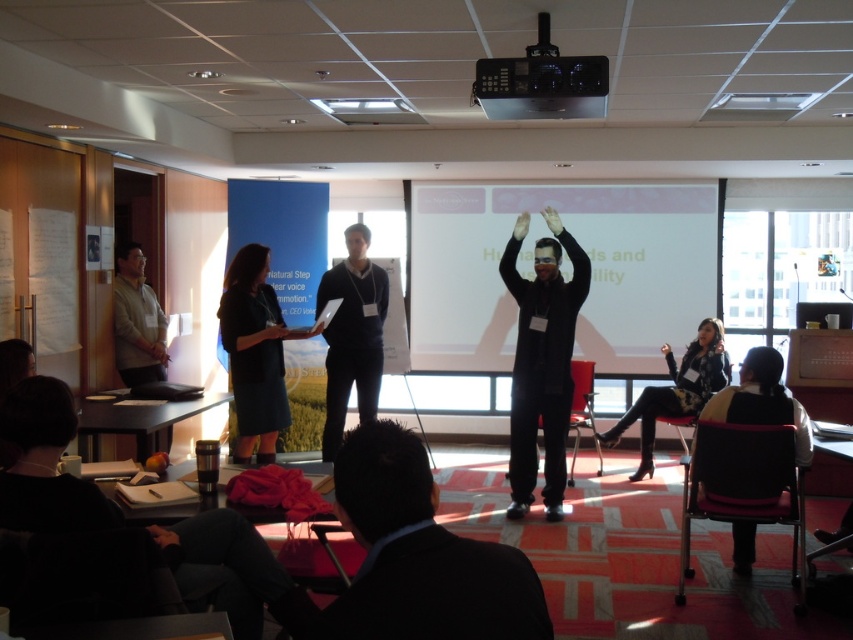
Looking at this image, you are standing in the conference room and see two points marked on the projection screen. Which point is closer to you, point (360, 232) or point (651, 401)?

Point (360, 232) is closer to the viewer than point (651, 401).

You are a photographer positioned at the camera. You need to capture a clear photo of the white matte projection screen at center. The camera has a focal length of 50mm. Considering the distance, will the screen fill the frame adequately?

The white matte projection screen at center is 22.86 feet away from the camera. At 50mm focal length, this distance may result in the screen appearing small within the frame. To ensure it fills the frame adequately, you might need to use a longer focal length or move closer if possible.